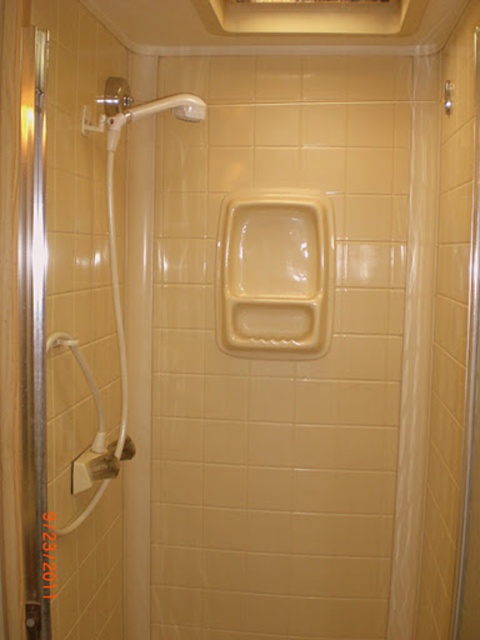
You are a contractor measuring the height of the beige matte urinal at center and the clear plastic shower curtain at right for installation purposes. Which object has a greater height?

The clear plastic shower curtain at right is taller than the beige matte urinal at center.

You are a plumber inspecting the shower area. You notice a point marked at coordinates (276, 273). Based on the scene description, what object is located at that point?

The point at coordinates (276, 273) indicates the location of the beige matte urinal at center.